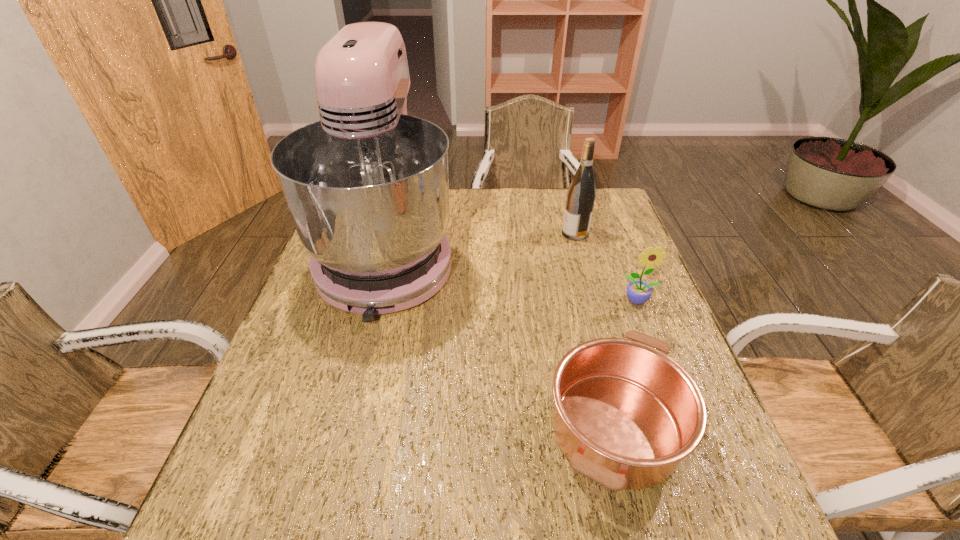
At what (x,y) coordinates should I click in order to perform the action: click on mixer that is at the far edge. Please return your answer as a coordinate pair (x, y). Looking at the image, I should click on (367, 186).

At what (x,y) coordinates should I click in order to perform the action: click on wine bottle that is at the far edge. Please return your answer as a coordinate pair (x, y). The width and height of the screenshot is (960, 540). Looking at the image, I should click on (581, 194).

The image size is (960, 540). Identify the location of object that is at the near edge. (625, 414).

At what (x,y) coordinates should I click in order to perform the action: click on object located in the left edge section of the desktop. Please return your answer as a coordinate pair (x, y). Looking at the image, I should click on (367, 186).

The height and width of the screenshot is (540, 960). I want to click on wine bottle located in the right edge section of the desktop, so click(581, 194).

In order to click on sunflower present at the right edge in this screenshot , I will do `click(638, 292)`.

The image size is (960, 540). Find the location of `saucepan that is at the right edge`. saucepan that is at the right edge is located at coordinates (625, 414).

At what (x,y) coordinates should I click in order to perform the action: click on object that is at the far left corner. Please return your answer as a coordinate pair (x, y). The height and width of the screenshot is (540, 960). Looking at the image, I should click on (367, 186).

Where is `object located at the far right corner`? This screenshot has height=540, width=960. object located at the far right corner is located at coordinates (581, 194).

Find the location of a particular element. Image resolution: width=960 pixels, height=540 pixels. object that is at the near right corner is located at coordinates (625, 414).